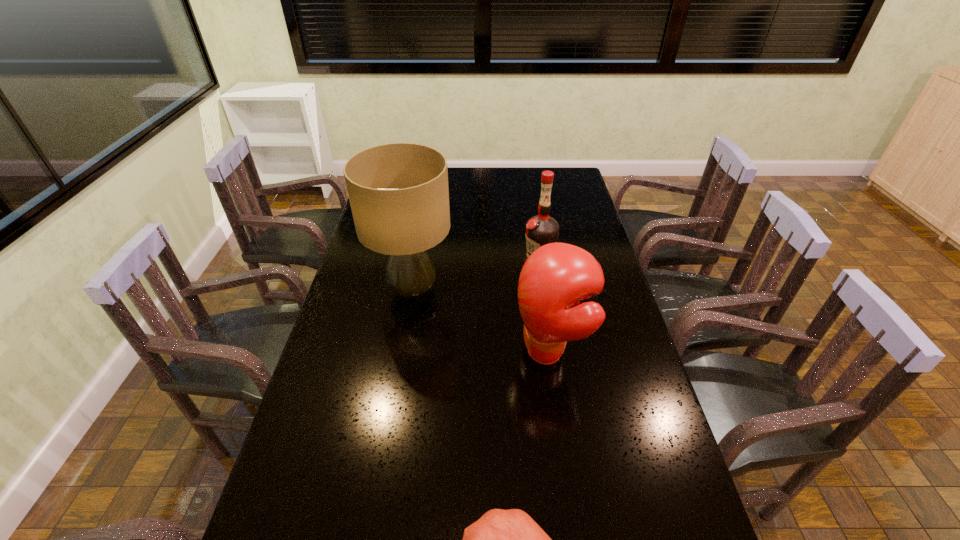
I want to click on the closest object relative to the boxing glove, so click(x=399, y=196).